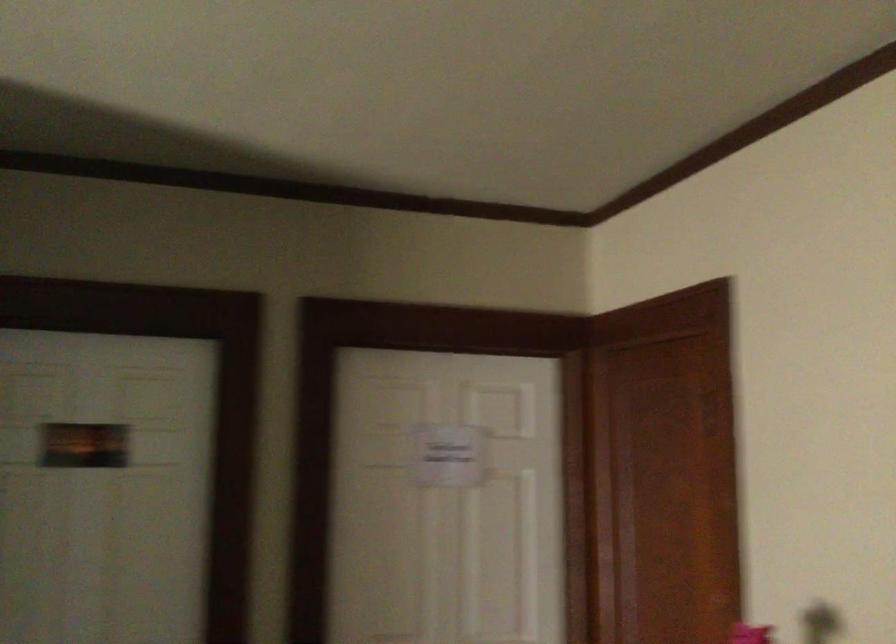
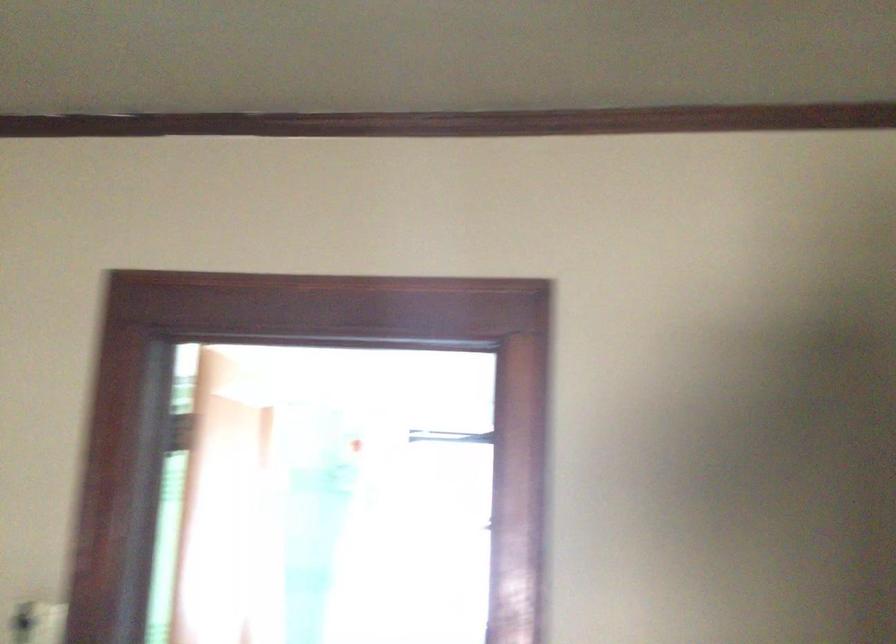
Question: The camera is either moving clockwise (left) or counter-clockwise (right) around the object. The first image is from the beginning of the video and the second image is from the end. Is the camera moving left or right when shooting the video?

Choices:
 (A) Left
 (B) Right

Answer: (A)